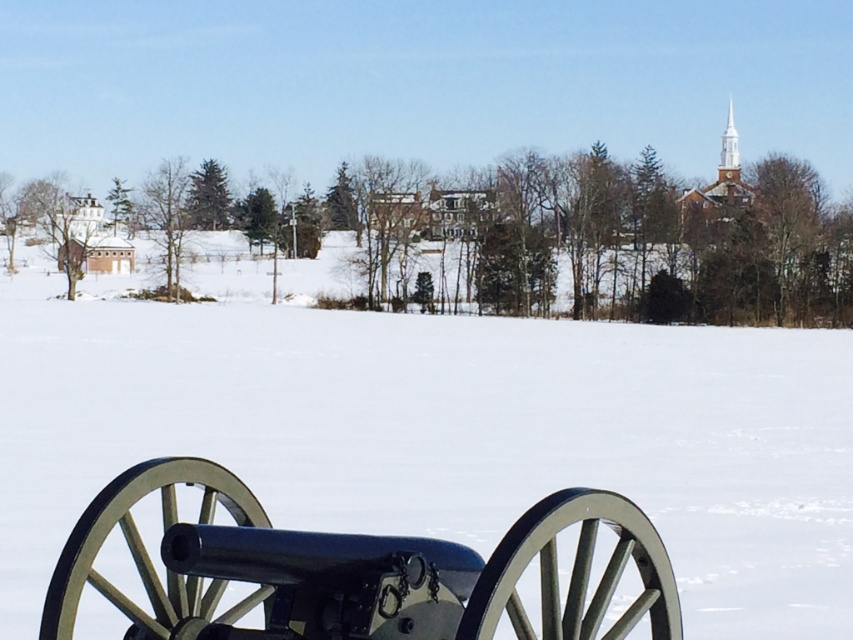
You are an artist setting up an easel to paint the winter scene. You want to ensure both the polished steel cannon at lower left and the white wooden steeple at upper right are visible in your composition. Considering their sizes, which object should you place closer to the center of your canvas to balance the composition?

The polished steel cannon at lower left occupies less space than the white wooden steeple at upper right, so to balance the composition, you should place the polished steel cannon at lower left closer to the center of the canvas since it is smaller and needs more emphasis to balance the larger steeple.

You are an observer standing in the snowfield. You see the polished steel cannon at lower left and the white wooden steeple at upper right. Which object is located to the left of the other?

The polished steel cannon at lower left is positioned on the left side of white wooden steeple at upper right.

You are an artist planning to paint the winter landscape. You want to ensure the proportions between the polished steel cannon at lower left and the white wooden steeple at upper right are accurate. Which object should you depict as having a smaller width in your painting?

The polished steel cannon at lower left should be depicted as having a smaller width because it is thinner than the white wooden steeple at upper right.